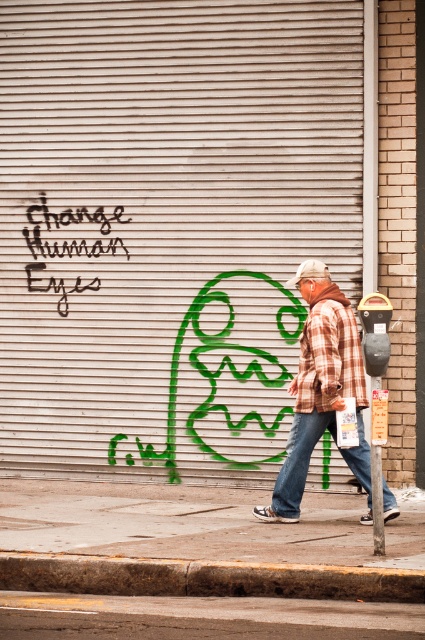
Between point (314, 397) and point (382, 326), which one is positioned behind?

The point (314, 397) is more distant.

Can you confirm if plaid flannel shirt at center is positioned above black plastic parking meter at right?

Yes.

Does point (359, 362) lie behind point (374, 352)?

Yes, it is behind point (374, 352).

Image resolution: width=425 pixels, height=640 pixels. I want to click on plaid flannel shirt at center, so click(329, 356).

Which of these two, gray concrete sidewalk at lower center or black graffiti at upper left, stands taller?

Standing taller between the two is black graffiti at upper left.

Describe the element at coordinates (201, 524) in the screenshot. This screenshot has height=640, width=425. I see `gray concrete sidewalk at lower center` at that location.

Between point (234, 499) and point (107, 244), which one is positioned behind?

Positioned behind is point (107, 244).

Find the location of a particular element. The width and height of the screenshot is (425, 640). gray concrete sidewalk at lower center is located at coordinates (201, 524).

Which of these two, wooden textured garage door at center or denim at center, stands taller?

wooden textured garage door at center is taller.

From the picture: Does wooden textured garage door at center appear on the right side of denim at center?

No, wooden textured garage door at center is not to the right of denim at center.

You are a GUI agent. You are given a task and a screenshot of the screen. Output one action in this format:
    pyautogui.click(x=<x>, y=<y>)
    Task: Click on the wooden textured garage door at center
    The height and width of the screenshot is (640, 425).
    Given the screenshot: What is the action you would take?
    pyautogui.click(x=169, y=225)

Identify the location of wooden textured garage door at center. This screenshot has height=640, width=425. (169, 225).